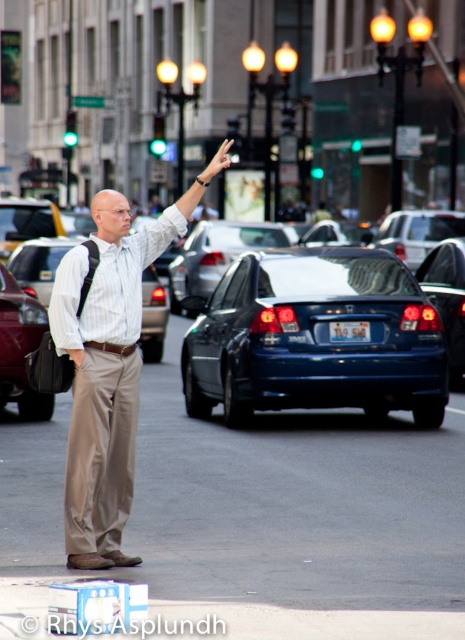
Who is taller, blue metallic sedan at center or yellow rubber taxi at center?

With more height is yellow rubber taxi at center.

In the scene shown: Is blue metallic sedan at center bigger than yellow rubber taxi at center?

Actually, blue metallic sedan at center might be smaller than yellow rubber taxi at center.

Between point (418, 266) and point (2, 218), which one is positioned in front?

Positioned in front is point (2, 218).

You are a GUI agent. You are given a task and a screenshot of the screen. Output one action in this format:
    pyautogui.click(x=<x>, y=<y>)
    Task: Click on the blue metallic sedan at center
    
    Given the screenshot: What is the action you would take?
    pyautogui.click(x=417, y=232)

Between glossy black car at center and green glass traffic light at upper left, which one appears on the right side from the viewer's perspective?

glossy black car at center

I want to click on glossy black car at center, so click(x=447, y=298).

Is point (453, 292) farther from viewer compared to point (67, 113)?

No.

Find the location of a particular element. glossy black car at center is located at coordinates (447, 298).

Does point (281, 371) come closer to viewer compared to point (73, 141)?

Yes, point (281, 371) is in front of point (73, 141).

Who is positioned more to the left, blue glossy sedan at center or green glass traffic light at upper left?

green glass traffic light at upper left is more to the left.

Is point (208, 337) closer to viewer compared to point (73, 145)?

Yes, it is.

Find the location of a particular element. The height and width of the screenshot is (640, 465). blue glossy sedan at center is located at coordinates (314, 339).